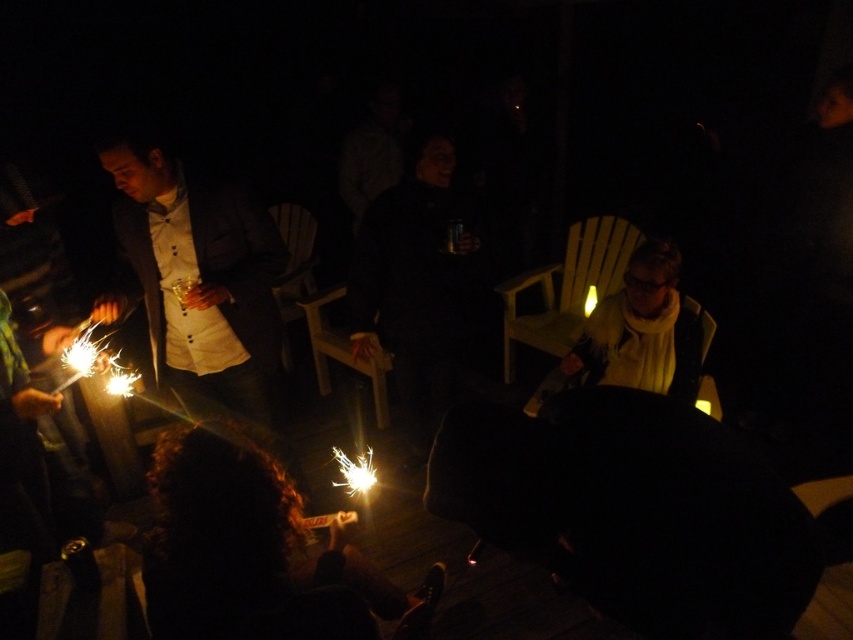
You are planning to seat guests at a table that is 1.2 meters wide. You have two chairs available, the wooden chair at center and the yellow plastic chair at center. Which chair should you choose to ensure both chairs fit comfortably on the table without overlapping?

The yellow plastic chair at center is narrower than the wooden chair at center. Since the table is 1.2 meters wide, using the yellow plastic chair at center would allow both chairs to fit comfortably without overlapping.

Looking at this image, you are planning to seat two guests in the chairs available. The first guest prefers a wider seat. Which chair should they choose between the yellow wood chair at center and the yellow plastic chair at center?

The yellow wood chair at center has a larger width than the yellow plastic chair at center, so the guest should choose the yellow wood chair at center.